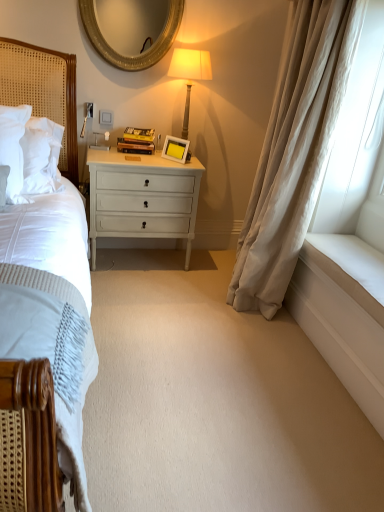
Question: Is woven wood headboard at left taller or shorter than white painted wood chest of drawers at center?

Choices:
 (A) tall
 (B) short

Answer: (B)

Question: In terms of width, does woven wood headboard at left look wider or thinner when compared to white painted wood chest of drawers at center?

Choices:
 (A) wide
 (B) thin

Answer: (B)

Question: Which object is positioned farthest from the matte gold lamp at upper center?

Choices:
 (A) woven wood headboard at left
 (B) white painted wood chest of drawers at center
 (C) beige silk curtain at right
 (D) gold textured mirror at upper center
 (E) white matte picture frame at center

Answer: (C)

Question: Estimate the real-world distances between objects in this image. Which object is farther from the gold textured mirror at upper center?

Choices:
 (A) beige silk curtain at right
 (B) matte gold lamp at upper center
 (C) white painted wood chest of drawers at center
 (D) white matte picture frame at center
 (E) woven wood headboard at left

Answer: (A)